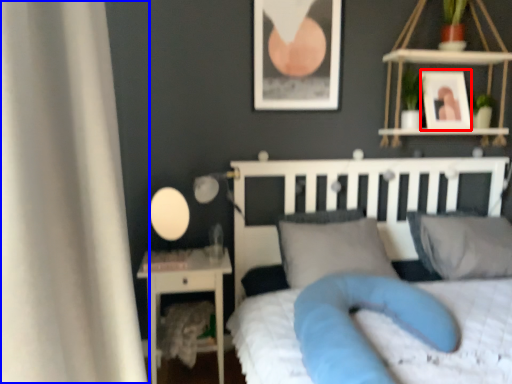
Question: Among these objects, which one is nearest to the camera, picture frame (highlighted by a red box) or curtain (highlighted by a blue box)?

Choices:
 (A) picture frame
 (B) curtain

Answer: (B)